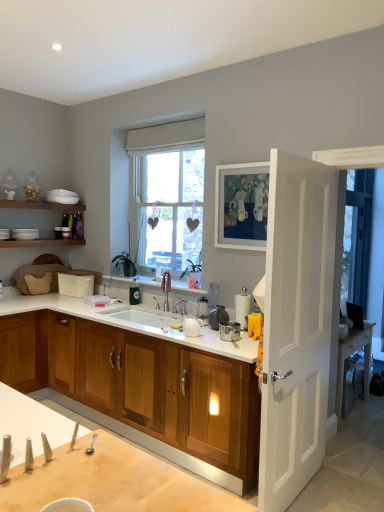
Question: Does wooden cabinet at center have a lesser height compared to white glossy sink at center?

Choices:
 (A) no
 (B) yes

Answer: (A)

Question: Is wooden cabinet at center further to camera compared to white glossy sink at center?

Choices:
 (A) no
 (B) yes

Answer: (A)

Question: Can you confirm if wooden cabinet at center is smaller than white glossy sink at center?

Choices:
 (A) yes
 (B) no

Answer: (B)

Question: Can you confirm if wooden cabinet at center is bigger than white glossy sink at center?

Choices:
 (A) no
 (B) yes

Answer: (B)

Question: Does wooden cabinet at center appear on the left side of white glossy sink at center?

Choices:
 (A) no
 (B) yes

Answer: (A)

Question: From the image's perspective, is wooden cabinet at center below white glossy sink at center?

Choices:
 (A) yes
 (B) no

Answer: (A)

Question: Does white wooden door at right have a larger size compared to white matte picture frame at upper center?

Choices:
 (A) yes
 (B) no

Answer: (A)

Question: Is white matte picture frame at upper center at the back of white wooden door at right?

Choices:
 (A) no
 (B) yes

Answer: (B)

Question: From a real-world perspective, is white wooden door at right physically above white matte picture frame at upper center?

Choices:
 (A) no
 (B) yes

Answer: (A)

Question: Would you say white wooden door at right is a long distance from white matte picture frame at upper center?

Choices:
 (A) no
 (B) yes

Answer: (A)

Question: Is white wooden door at right at the right side of white matte picture frame at upper center?

Choices:
 (A) no
 (B) yes

Answer: (B)

Question: Would you say white wooden door at right contains white matte picture frame at upper center?

Choices:
 (A) yes
 (B) no

Answer: (B)

Question: From a real-world perspective, is white glossy sink at center on top of wooden cabinet at center?

Choices:
 (A) no
 (B) yes

Answer: (B)